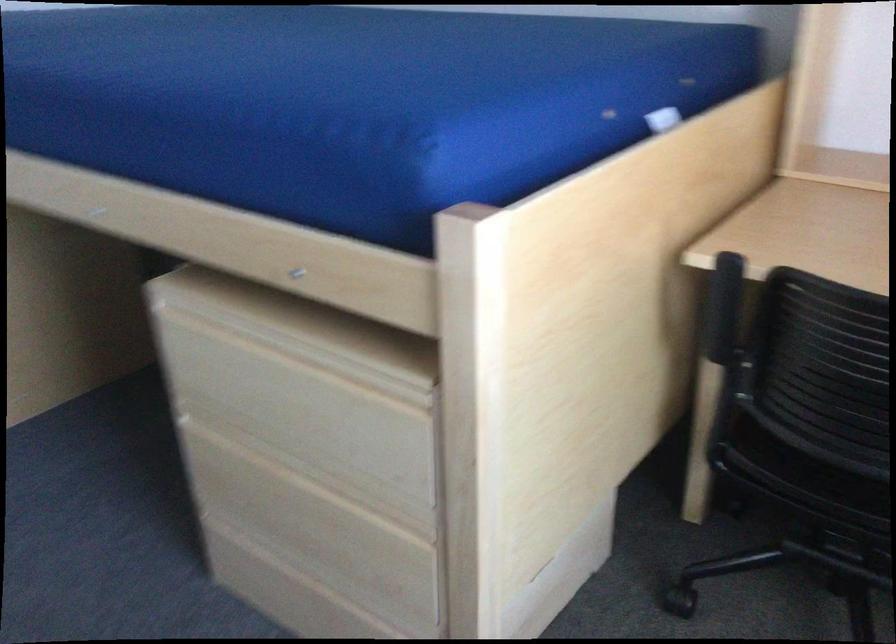
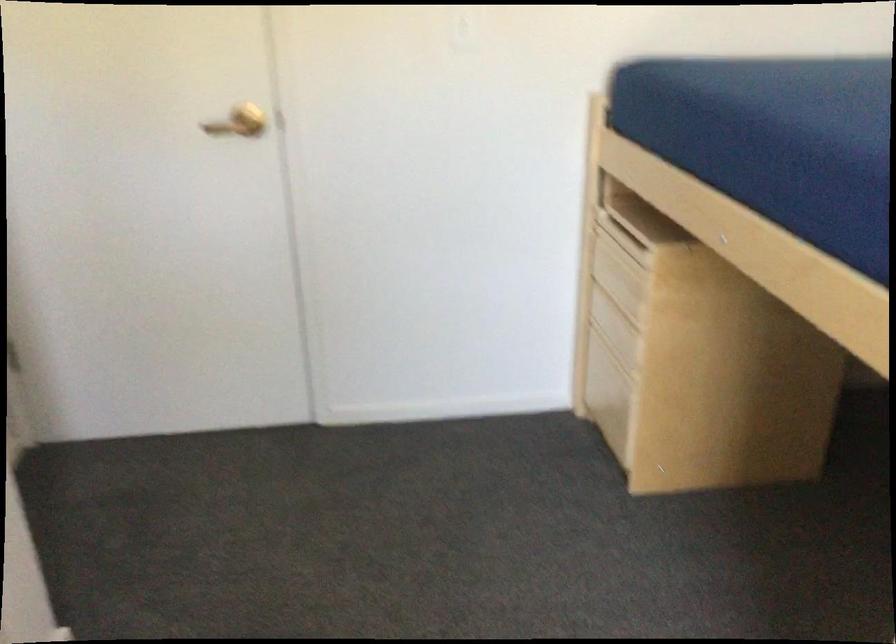
Question: Based on the continuous images, in which direction is the camera rotating? Reply with the corresponding letter.

Choices:
 (A) Left
 (B) Right
 (C) Up
 (D) Down

Answer: (A)